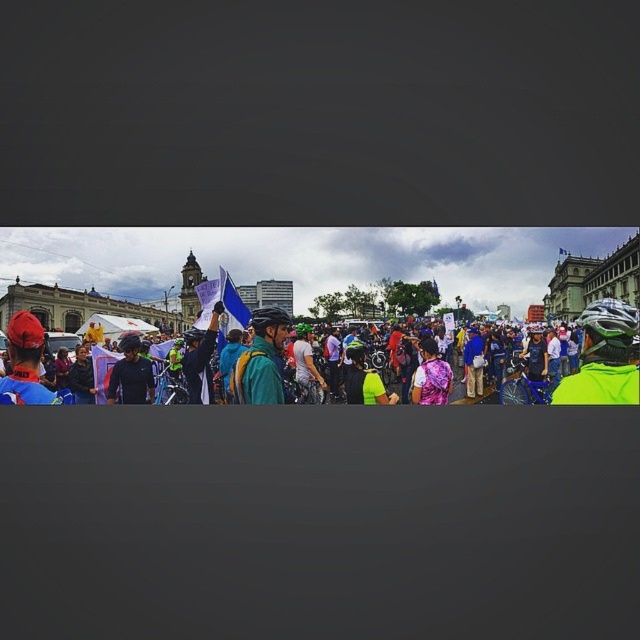
Does neon yellow jacket at center have a greater width compared to matte black helmet at center?

Correct, the width of neon yellow jacket at center exceeds that of matte black helmet at center.

Which is in front, point (616, 342) or point (269, 308)?

Point (616, 342)

Describe the element at coordinates (604, 355) in the screenshot. I see `neon yellow jacket at center` at that location.

This screenshot has height=640, width=640. What are the coordinates of `neon yellow jacket at center` in the screenshot? It's located at (604, 355).

From the picture: Who is lower down, green matte bicycle helmet at center-right or pink sequined dress at center?

pink sequined dress at center is lower down.

Does green matte bicycle helmet at center-right appear under pink sequined dress at center?

Incorrect, green matte bicycle helmet at center-right is not positioned below pink sequined dress at center.

You are a GUI agent. You are given a task and a screenshot of the screen. Output one action in this format:
    pyautogui.click(x=<x>, y=<y>)
    Task: Click on the green matte bicycle helmet at center-right
    
    Given the screenshot: What is the action you would take?
    pyautogui.click(x=609, y=330)

Does neon yellow jacket at center have a greater height compared to pink sequined dress at center?

Yes, neon yellow jacket at center is taller than pink sequined dress at center.

In the scene shown: Who is positioned more to the left, neon yellow jacket at center or pink sequined dress at center?

neon yellow jacket at center

Does point (260, 348) come farther from viewer compared to point (420, 342)?

No, (260, 348) is closer to viewer.

I want to click on neon yellow jacket at center, so click(x=604, y=355).